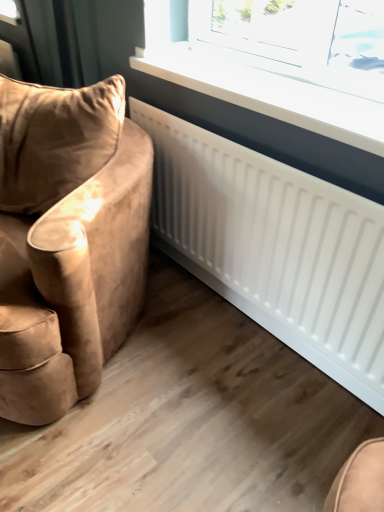
Question: Relative to white glossy radiator at upper center, is suede-like brown armchair at left in front or behind?

Choices:
 (A) front
 (B) behind

Answer: (A)

Question: Is suede-like brown armchair at left bigger or smaller than white glossy radiator at upper center?

Choices:
 (A) small
 (B) big

Answer: (B)

Question: Is suede-like brown armchair at left inside or outside of white glossy radiator at upper center?

Choices:
 (A) inside
 (B) outside

Answer: (B)

Question: Choose the correct answer: Is white glossy radiator at upper center inside suede-like brown armchair at left or outside it?

Choices:
 (A) inside
 (B) outside

Answer: (B)

Question: Considering their positions, is white glossy radiator at upper center located in front of or behind suede-like brown armchair at left?

Choices:
 (A) front
 (B) behind

Answer: (B)

Question: Considering the relative positions of white glossy radiator at upper center and suede-like brown armchair at left in the image provided, is white glossy radiator at upper center to the left or to the right of suede-like brown armchair at left?

Choices:
 (A) right
 (B) left

Answer: (A)

Question: Is white glossy radiator at upper center taller or shorter than suede-like brown armchair at left?

Choices:
 (A) short
 (B) tall

Answer: (A)